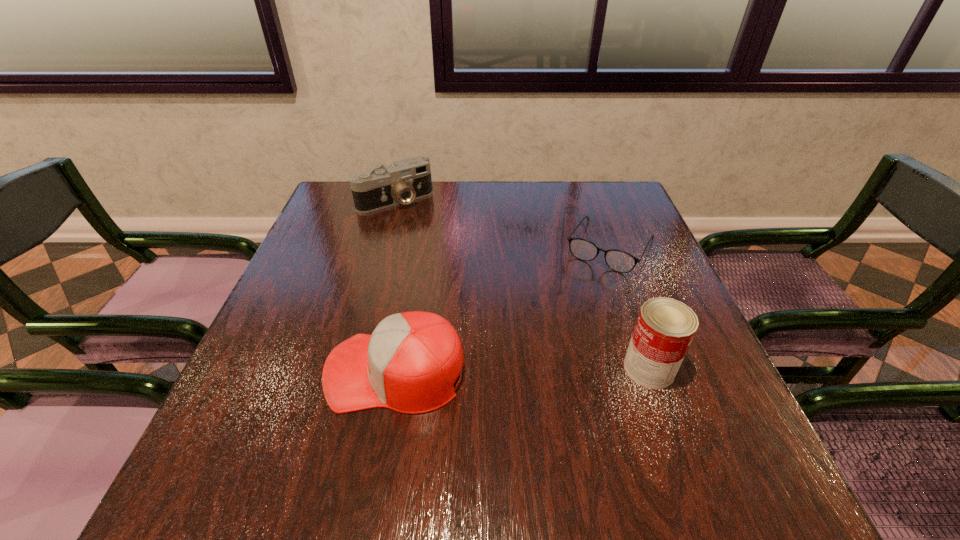
Identify the location of vacant space at the near right corner. (721, 409).

The width and height of the screenshot is (960, 540). In order to click on vacant space that is in between the baseball cap and the camera in this screenshot , I will do `click(396, 286)`.

Find the location of a particular element. This screenshot has height=540, width=960. vacant area between the baseball cap and the tallest object is located at coordinates (522, 370).

Find the location of a particular element. free space between the can and the camera is located at coordinates (522, 284).

In order to click on free space that is in between the spectacles and the farthest object in this screenshot , I will do `click(502, 224)`.

The height and width of the screenshot is (540, 960). Identify the location of vacant space that is in between the baseball cap and the spectacles. (503, 309).

Where is `vacant area that lies between the shortest object and the baseball cap`? This screenshot has width=960, height=540. vacant area that lies between the shortest object and the baseball cap is located at coordinates (503, 309).

The image size is (960, 540). In order to click on free space between the spectacles and the camera in this screenshot , I will do `click(502, 224)`.

Where is `free space that is in between the tallest object and the shortest object`? This screenshot has height=540, width=960. free space that is in between the tallest object and the shortest object is located at coordinates (630, 308).

This screenshot has height=540, width=960. In order to click on free space between the baseball cap and the farthest object in this screenshot , I will do `click(396, 286)`.